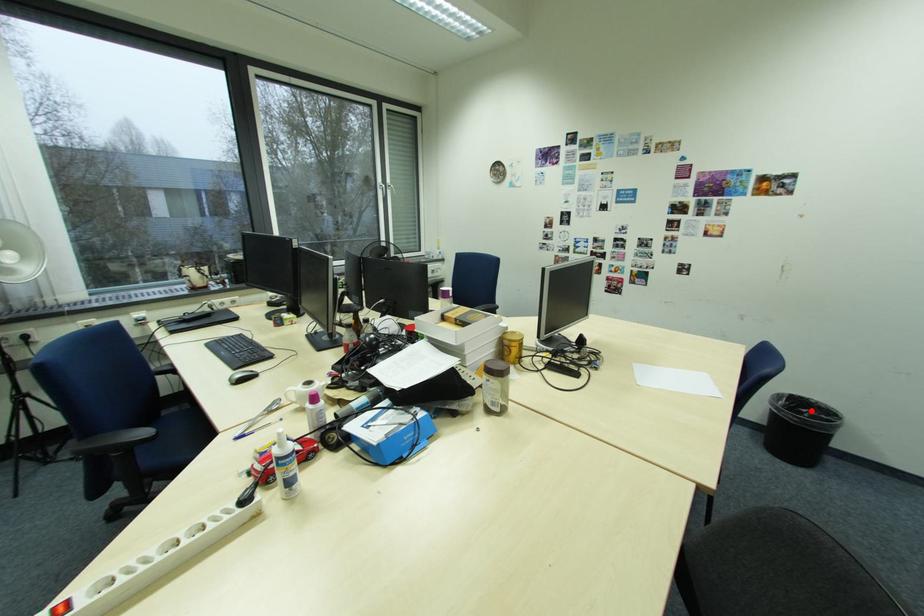
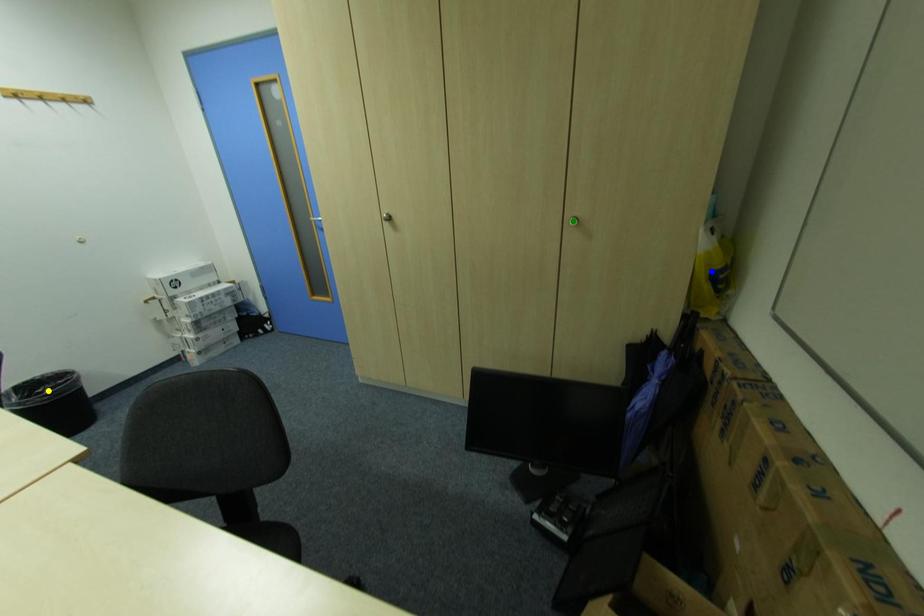
Question: I am providing you with two images of the same scene from different viewpoints. A red point is marked on the first image. You are given multiple points on the second image. Which point in image 2 represents the same 3d spot as the red point in image 1?

Choices:
 (A) blue point
 (B) green point
 (C) yellow point

Answer: (C)